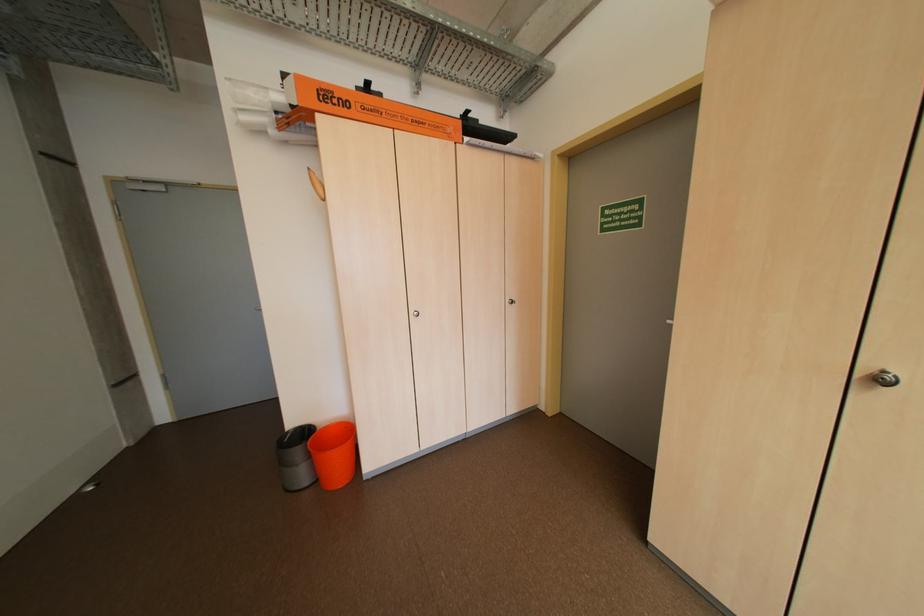
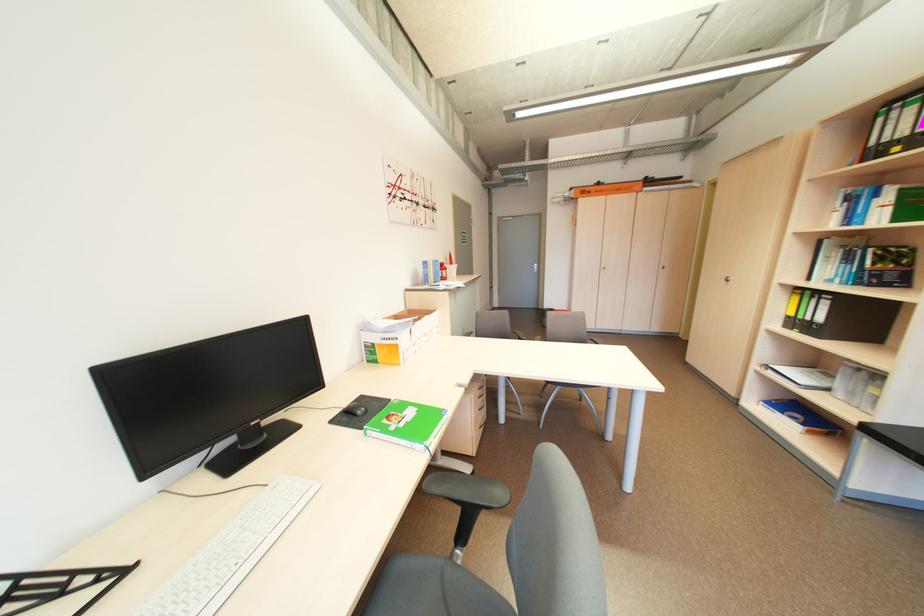
Find the pixel in the second image that matches pixel 356 105 in the first image.

(599, 193)